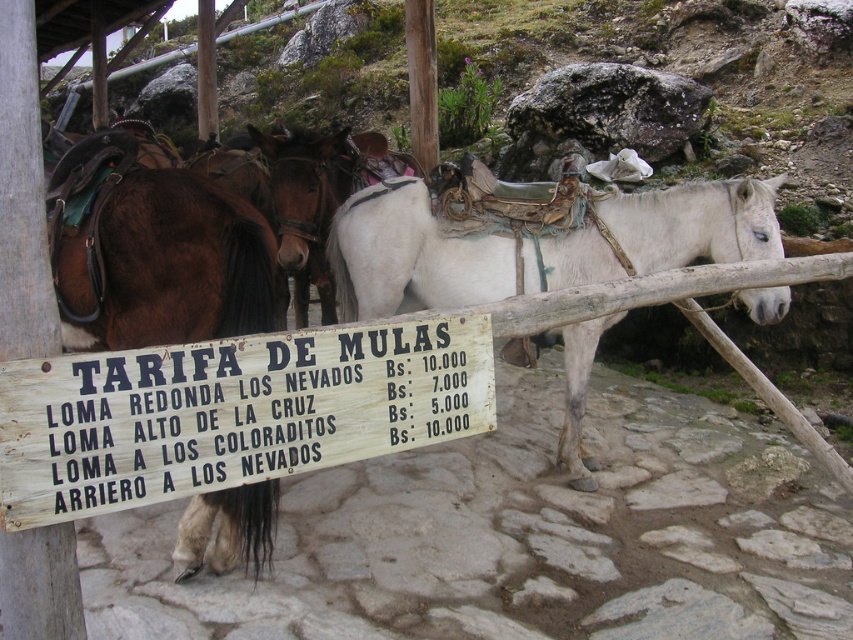
Does black wood sign at center have a smaller size compared to brown glossy horse at left?

Indeed, black wood sign at center has a smaller size compared to brown glossy horse at left.

Is black wood sign at center positioned behind brown glossy horse at left?

No, black wood sign at center is closer to the viewer.

Is point (247, 346) in front of point (238, 196)?

Yes.

The image size is (853, 640). Find the location of `black wood sign at center`. black wood sign at center is located at coordinates (248, 410).

How far apart are brown glossy horse at left and white leather horse at center?

1.41 meters

Is brown glossy horse at left closer to the viewer compared to white leather horse at center?

Yes, brown glossy horse at left is closer to the viewer.

Locate an element on the screen. brown glossy horse at left is located at coordinates (155, 252).

Is black wood sign at center positioned at the back of white leather horse at center?

No.

Can you confirm if black wood sign at center is taller than white leather horse at center?

No.

Where is `black wood sign at center`? Image resolution: width=853 pixels, height=640 pixels. black wood sign at center is located at coordinates (248, 410).

Find the location of a particular element. black wood sign at center is located at coordinates (248, 410).